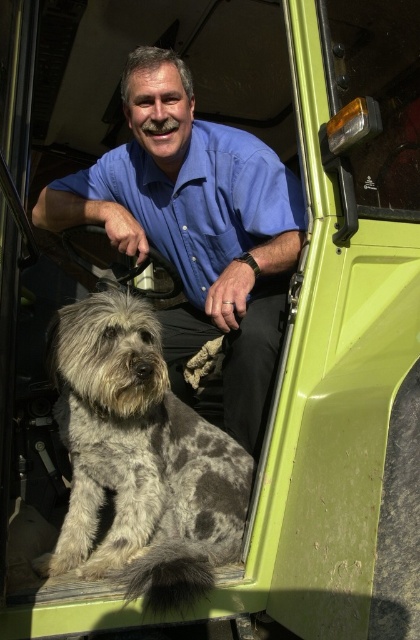
Who is taller, blue cotton shirt at center or gray speckled fur dog at center?

blue cotton shirt at center is taller.

Is blue cotton shirt at center to the left of gray speckled fur dog at center from the viewer's perspective?

No, blue cotton shirt at center is not to the left of gray speckled fur dog at center.

Which is behind, point (246, 232) or point (65, 524)?

The point (246, 232) is more distant.

You are a GUI agent. You are given a task and a screenshot of the screen. Output one action in this format:
    pyautogui.click(x=<x>, y=<y>)
    Task: Click on the blue cotton shirt at center
    
    Given the screenshot: What is the action you would take?
    click(x=196, y=227)

Which is below, gray speckled fur dog at center or blue cotton shirt at upper center?

gray speckled fur dog at center

Who is more distant from viewer, (84, 552) or (301, 186)?

The point (301, 186) is behind.

The width and height of the screenshot is (420, 640). I want to click on gray speckled fur dog at center, so click(139, 460).

Does blue cotton shirt at center have a smaller size compared to blue cotton shirt at upper center?

Incorrect, blue cotton shirt at center is not smaller in size than blue cotton shirt at upper center.

Which is above, blue cotton shirt at center or blue cotton shirt at upper center?

blue cotton shirt at upper center is higher up.

Where is `blue cotton shirt at center`? Image resolution: width=420 pixels, height=640 pixels. blue cotton shirt at center is located at coordinates (196, 227).